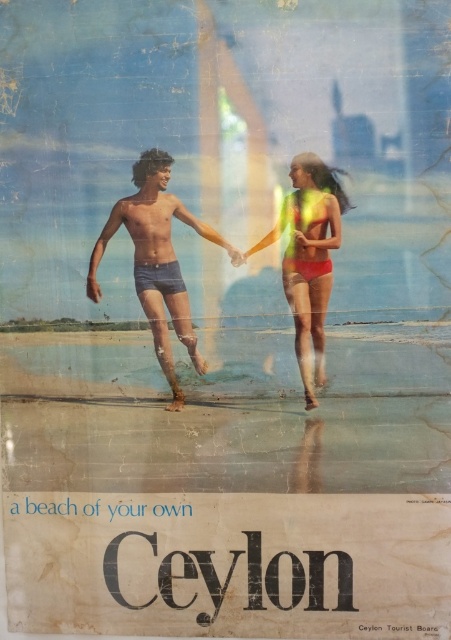
Question: Does blue denim shorts at center have a larger size compared to matte yellow bikini at center?

Choices:
 (A) yes
 (B) no

Answer: (A)

Question: Does blue denim shorts at center appear under matte yellow bikini at center?

Choices:
 (A) yes
 (B) no

Answer: (B)

Question: Which of the following is the farthest from the observer?

Choices:
 (A) matte yellow bikini at center
 (B) blue denim shorts at center

Answer: (B)

Question: Which of the following is the closest to the observer?

Choices:
 (A) (328, 205)
 (B) (96, 296)

Answer: (A)

Question: Can you confirm if blue denim shorts at center is positioned to the left of matte yellow bikini at center?

Choices:
 (A) yes
 (B) no

Answer: (A)